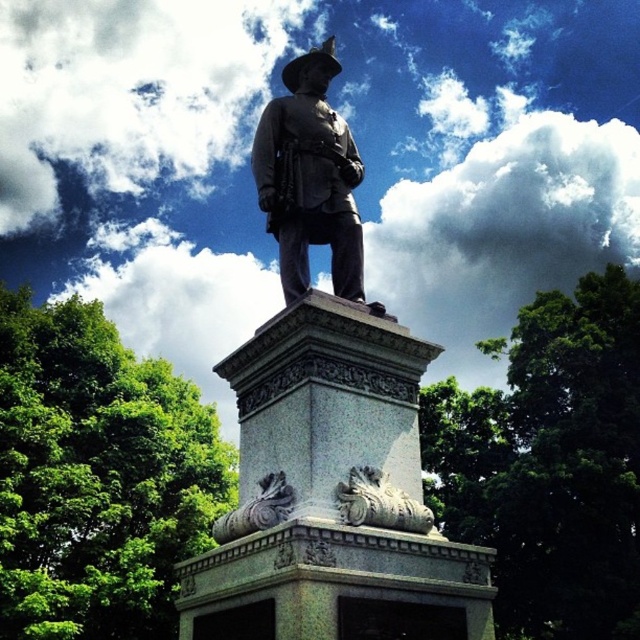
Can you confirm if gray stone statue at center is thinner than carved stone ornament at center?

No.

Who is taller, gray stone statue at center or carved stone ornament at center?

gray stone statue at center is taller.

The image size is (640, 640). I want to click on gray stone statue at center, so click(x=326, y=422).

The image size is (640, 640). I want to click on gray stone statue at center, so click(326, 422).

Does gray stone statue at center appear under carved stone lion at lower center?

Actually, gray stone statue at center is above carved stone lion at lower center.

The height and width of the screenshot is (640, 640). Identify the location of gray stone statue at center. (326, 422).

Image resolution: width=640 pixels, height=640 pixels. Find the location of `gray stone statue at center`. gray stone statue at center is located at coordinates (326, 422).

Which of these two, polished bronze statue at center or carved stone ornament at center, stands taller?

With more height is polished bronze statue at center.

The width and height of the screenshot is (640, 640). In order to click on polished bronze statue at center in this screenshot , I will do `click(308, 177)`.

The image size is (640, 640). In order to click on polished bronze statue at center in this screenshot , I will do `click(308, 177)`.

The image size is (640, 640). In order to click on polished bronze statue at center in this screenshot , I will do `click(308, 177)`.